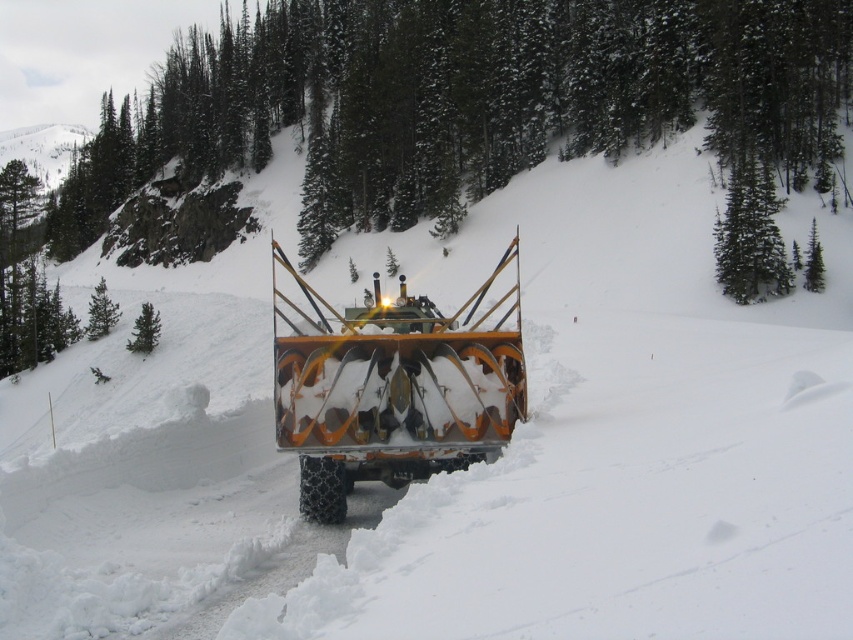
Locate an element on the screen. The width and height of the screenshot is (853, 640). green textured pine at center is located at coordinates (463, 99).

Is point (267, 90) positioned behind point (750, 211)?

Yes, point (267, 90) is behind point (750, 211).

This screenshot has height=640, width=853. I want to click on green textured pine at center, so [x=463, y=99].

Find the location of a particular element. This screenshot has height=640, width=853. green textured pine at center is located at coordinates (463, 99).

Is point (711, 97) in front of point (148, 326)?

Yes, point (711, 97) is in front of point (148, 326).

Does green textured pine at center have a lesser width compared to green matte tree at left?

No.

Is point (79, 243) closer to viewer compared to point (137, 340)?

No, it is not.

This screenshot has height=640, width=853. I want to click on green textured pine at center, so click(x=463, y=99).

Between orange metallic snowplow at center and green matte tree at left, which one appears on the left side from the viewer's perspective?

Positioned to the left is green matte tree at left.

Is orange metallic snowplow at center to the left of green matte tree at left from the viewer's perspective?

In fact, orange metallic snowplow at center is to the right of green matte tree at left.

Is point (468, 336) closer to camera compared to point (148, 333)?

Yes.

The width and height of the screenshot is (853, 640). I want to click on orange metallic snowplow at center, so click(392, 388).